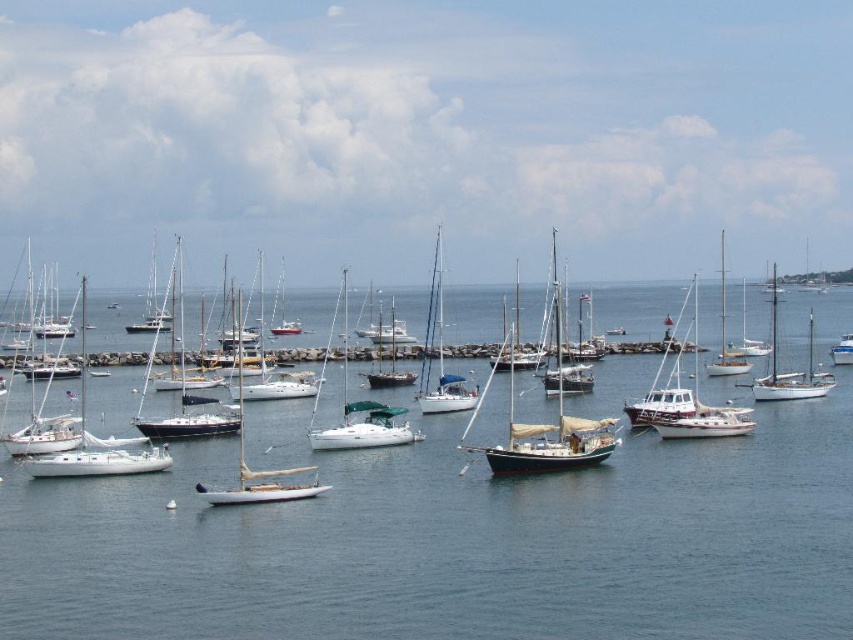
Question: Does blue water at center have a larger size compared to dark brown wooden sailboat at center?

Choices:
 (A) no
 (B) yes

Answer: (A)

Question: Does dark brown wooden sailboat at center have a smaller size compared to white matte sailboat at center-right?

Choices:
 (A) no
 (B) yes

Answer: (A)

Question: Which object appears farthest from the camera in this image?

Choices:
 (A) white matte sailboat at center-right
 (B) dark brown wooden sailboat at center
 (C) blue water at center

Answer: (A)

Question: Is blue water at center smaller than dark brown wooden sailboat at center?

Choices:
 (A) no
 (B) yes

Answer: (B)

Question: Which point is farther to the camera?

Choices:
 (A) blue water at center
 (B) white matte sailboat at center-right

Answer: (B)

Question: Among these points, which one is nearest to the camera?

Choices:
 (A) (610, 449)
 (B) (833, 352)
 (C) (175, 484)

Answer: (C)